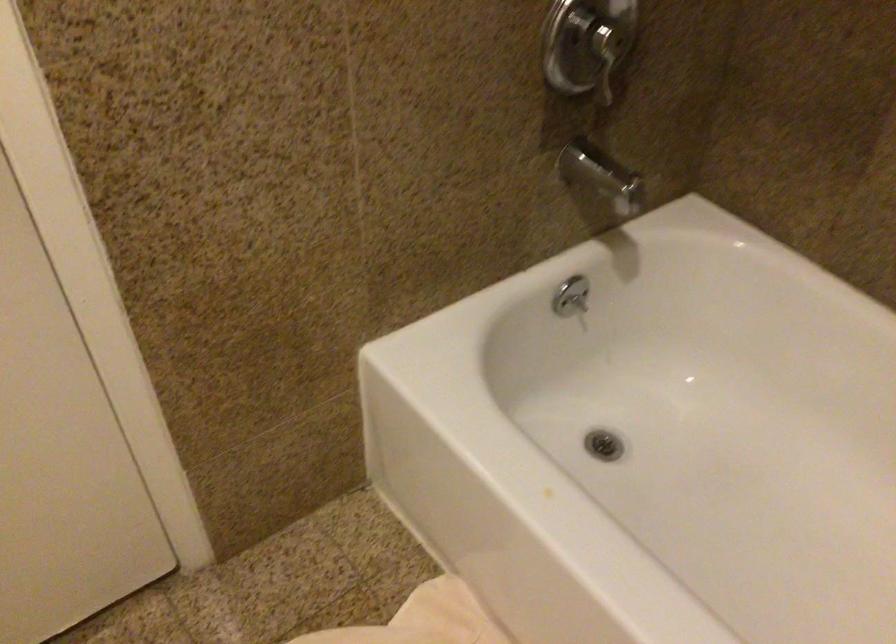
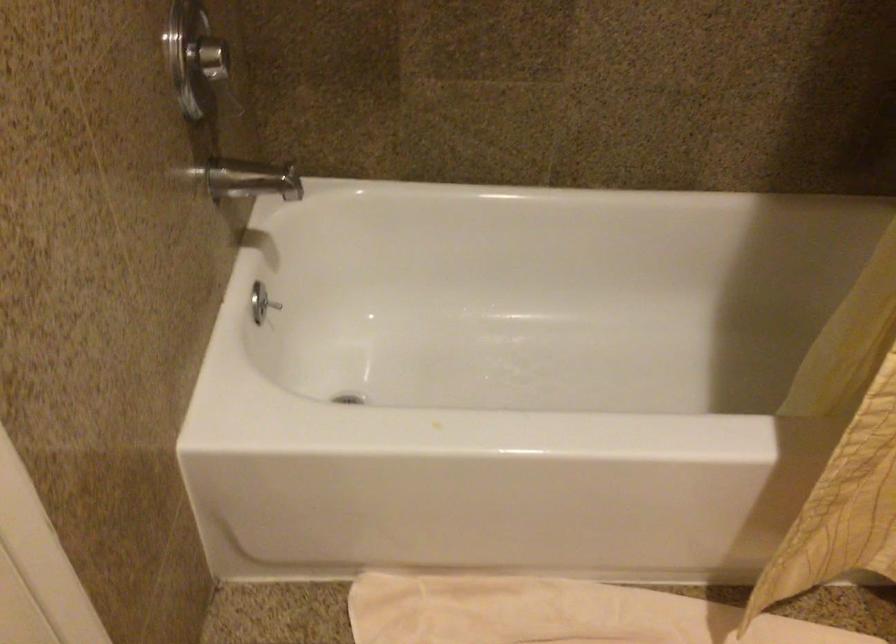
Question: The first image is from the beginning of the video and the second image is from the end. How did the camera likely rotate when shooting the video?

Choices:
 (A) Left
 (B) Right
 (C) Up
 (D) Down

Answer: (B)